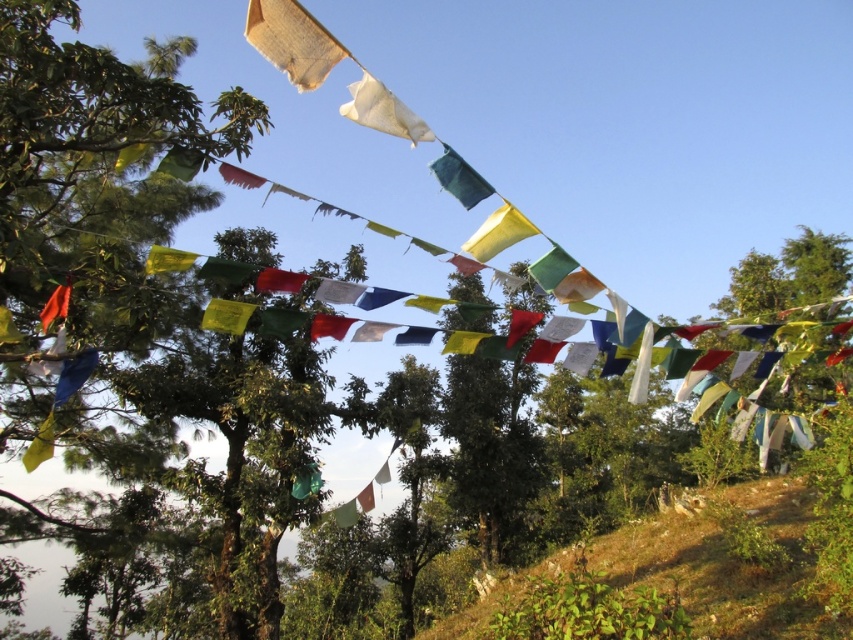
Question: Which object is positioned closest to the yellow matte flag at center?

Choices:
 (A) yellow fabric flag at upper left
 (B) orange fabric flag at left
 (C) green leafy hillside at lower right
 (D) teal fabric flag at upper center

Answer: (D)

Question: Is yellow matte flag at center thinner than yellow fabric flag at upper left?

Choices:
 (A) yes
 (B) no

Answer: (A)

Question: Among these objects, which one is farthest from the camera?

Choices:
 (A) teal fabric flag at upper center
 (B) yellow fabric flag at upper left

Answer: (B)

Question: In this image, where is yellow matte flag at center located relative to yellow fabric flag at upper left?

Choices:
 (A) left
 (B) right

Answer: (B)

Question: In this image, where is white fabric flag at upper center located relative to yellow matte flag at center?

Choices:
 (A) left
 (B) right

Answer: (A)

Question: Which point is farther to the camera?

Choices:
 (A) teal fabric flag at upper center
 (B) yellow fabric flag at upper left

Answer: (B)